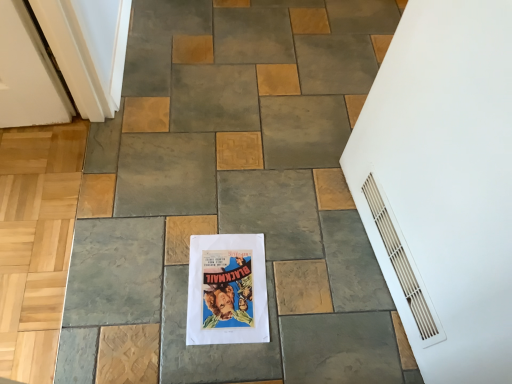
This screenshot has height=384, width=512. Find the location of `matte paper poster at center`. matte paper poster at center is located at coordinates (227, 290).

Measure the distance between point (210, 267) and camera.

A distance of 3.86 feet exists between point (210, 267) and camera.

Describe the element at coordinates (227, 290) in the screenshot. I see `matte paper poster at center` at that location.

Locate an element on the screen. The image size is (512, 384). matte paper poster at center is located at coordinates (227, 290).